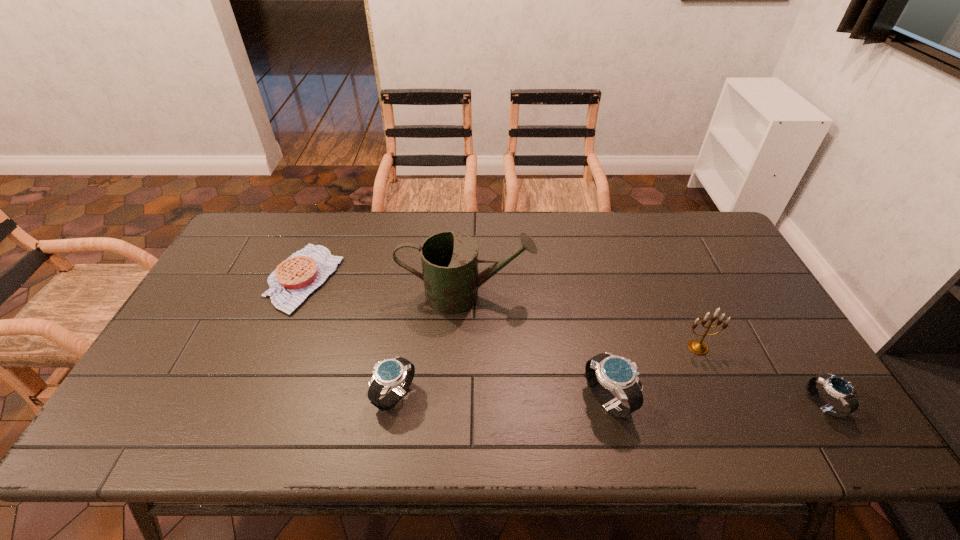
Find the location of `free space for a new watch on the left`. free space for a new watch on the left is located at coordinates (187, 391).